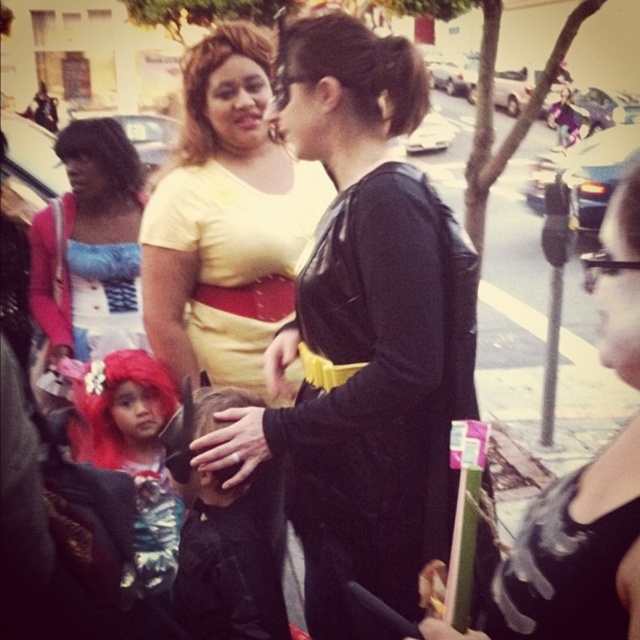
You are a photographer standing at the back of the scene. You want to take a photo of the black leather jacket at center and the black leather purse at center. Which object should you focus on first if you want to capture both in the same frame without moving the camera?

The black leather jacket at center is located above the black leather purse at center, so you should focus on the black leather jacket at center first to ensure both are in the frame.

You are a photographer trying to capture a candid shot of the two women in the scene. The yellow matte dress at center and the matte blue dress at left are part of your frame. Given that your camera has a minimum focus distance of 22 inches, will you be able to focus on both subjects clearly without moving the camera?

The yellow matte dress at center and the matte blue dress at left are 21.58 inches apart, which is less than the camera minimum focus distance of 22 inches. Therefore, the camera might not be able to focus on both subjects clearly without moving the camera.

You are a photographer trying to capture the perfect shot of the yellow matte dress at center. Based on the scene description, where should you position your camera to ensure the dress is centered in your photo?

To center the yellow matte dress at center in your photo, position your camera so that the dress aligns with the point at coordinates 0.344 on the x axis and 0.353 on the y axis.